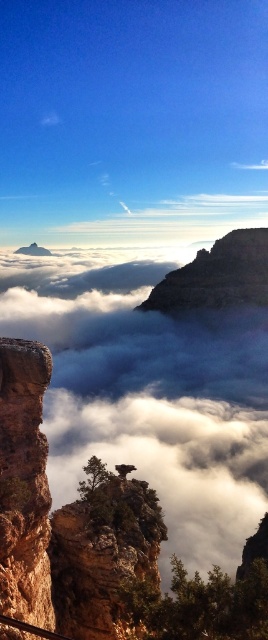
You are standing at the edge of the canyon and see the brown rough rock at center and the rustic sandstone rock formation at left. Which rock formation is closer to your left side?

The rustic sandstone rock formation at left is closer to your left side since it is positioned to the left of the brown rough rock at center.

You are a hiker planning to climb the rocks in the canyon. You see the brown rough rock at center and the rustic sandstone rock formation at left. Which rock is closer to the ground?

The brown rough rock at center is positioned under the rustic sandstone rock formation at left, so it is closer to the ground.